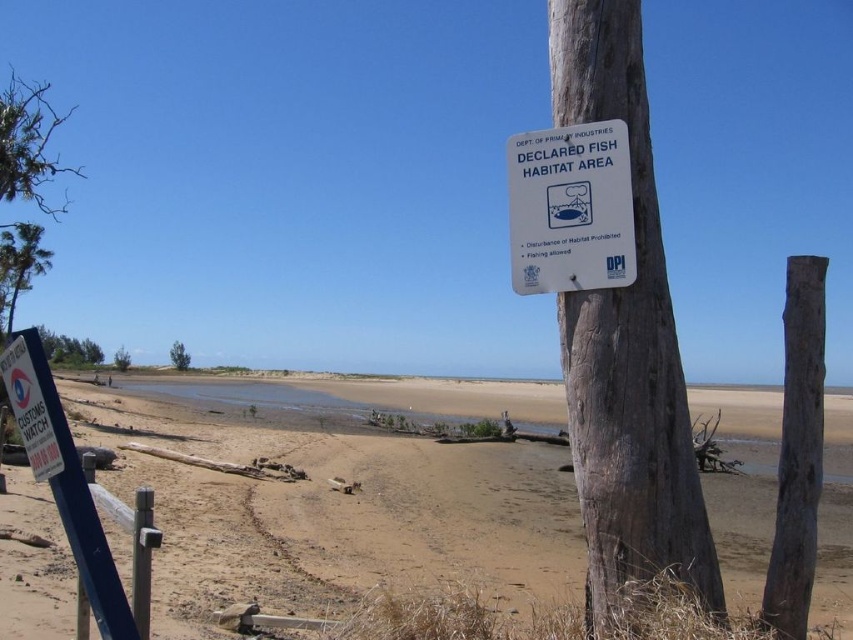
This screenshot has height=640, width=853. Describe the element at coordinates (625, 342) in the screenshot. I see `wooden sign at center` at that location.

Can you confirm if wooden sign at center is smaller than brown rough wood post at right?

Correct, wooden sign at center occupies less space than brown rough wood post at right.

This screenshot has height=640, width=853. What do you see at coordinates (625, 342) in the screenshot?
I see `wooden sign at center` at bounding box center [625, 342].

This screenshot has height=640, width=853. I want to click on wooden sign at center, so click(x=625, y=342).

Can you confirm if white plastic sign at upper center is positioned to the right of brown rough wood post at right?

In fact, white plastic sign at upper center is to the left of brown rough wood post at right.

Is white plastic sign at upper center above brown rough wood post at right?

Indeed, white plastic sign at upper center is positioned over brown rough wood post at right.

You are a GUI agent. You are given a task and a screenshot of the screen. Output one action in this format:
    pyautogui.click(x=<x>, y=<y>)
    Task: Click on the white plastic sign at upper center
    The width and height of the screenshot is (853, 640).
    Given the screenshot: What is the action you would take?
    pyautogui.click(x=570, y=209)

Which is in front, point (572, 573) or point (614, 524)?

Point (614, 524)

Is sandy brown beach at lower center bigger than wooden sign at center?

Correct, sandy brown beach at lower center is larger in size than wooden sign at center.

The image size is (853, 640). In order to click on sandy brown beach at lower center in this screenshot , I will do `click(364, 499)`.